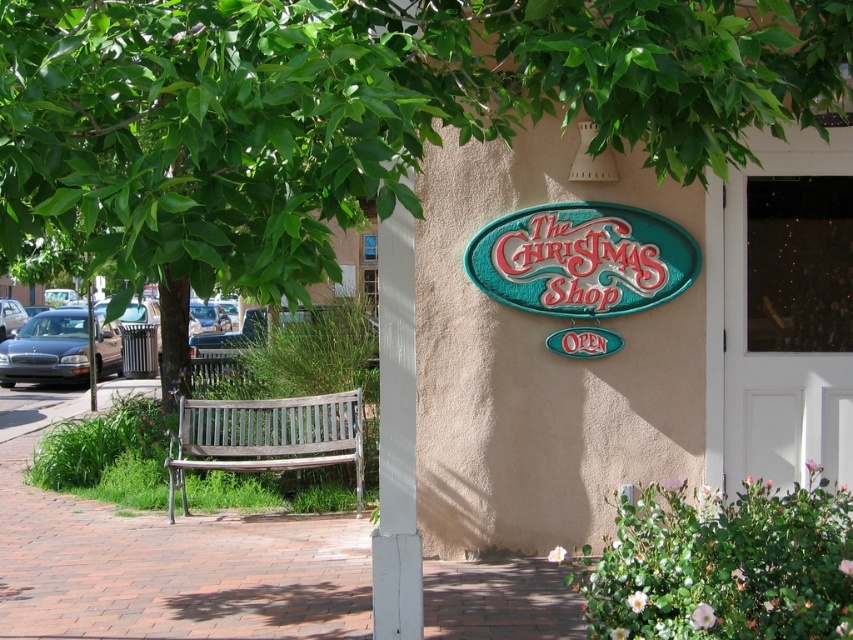
Identify the location of white wooden door at right. (788, 310).

Is white wooden door at right further to the viewer compared to matte dark gray sedan at left?

That is False.

Where is `white wooden door at right`? This screenshot has height=640, width=853. white wooden door at right is located at coordinates (788, 310).

Can you confirm if teal glossy sign at center is positioned to the left of matte dark gray sedan at left?

Incorrect, teal glossy sign at center is not on the left side of matte dark gray sedan at left.

Who is shorter, teal glossy sign at center or matte dark gray sedan at left?

With less height is teal glossy sign at center.

Which is in front, point (473, 269) or point (79, 310)?

Point (473, 269) is more forward.

Image resolution: width=853 pixels, height=640 pixels. Identify the location of teal glossy sign at center. (582, 259).

Can you confirm if green leafy tree at upper left is positioned to the left of white wooden door at right?

Correct, you'll find green leafy tree at upper left to the left of white wooden door at right.

Is green leafy tree at upper left below white wooden door at right?

No.

You are a GUI agent. You are given a task and a screenshot of the screen. Output one action in this format:
    pyautogui.click(x=<x>, y=<y>)
    Task: Click on the green leafy tree at upper left
    Image resolution: width=853 pixels, height=640 pixels.
    Given the screenshot: What is the action you would take?
    pyautogui.click(x=351, y=115)